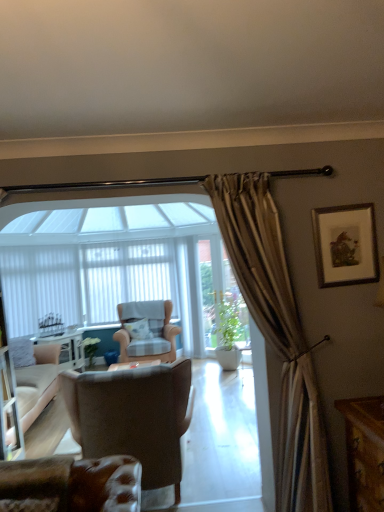
Question: Does point (137, 326) appear closer or farther from the camera than point (127, 324)?

Choices:
 (A) farther
 (B) closer

Answer: (A)

Question: Considering the relative positions of white textured pillow at center and checkered fabric armchair at center, which is counted as the third chair, starting from the front, in the image provided, is white textured pillow at center to the left or to the right of checkered fabric armchair at center, which is counted as the third chair, starting from the front,?

Choices:
 (A) right
 (B) left

Answer: (B)

Question: Estimate the real-world distances between objects in this image. Which object is closer to the brown leather chair at center, placed as the second chair when sorted from front to back?

Choices:
 (A) white textured pillow at center
 (B) white vertical blinds at center
 (C) leather at lower left, placed as the third chair when sorted from back to front
 (D) white glossy vase at center, the 2th plant from the right
 (E) white fabric curtain at left

Answer: (C)

Question: Which object is positioned closest to the brown leather chair at center, which ranks as the second chair in back-to-front order?

Choices:
 (A) green glossy plant at center, which ranks as the 2th plant in back-to-front order
 (B) white glossy vase at center, the 2th plant from the right
 (C) checkered fabric armchair at center, the first chair from the back
 (D) white vertical blinds at center
 (E) white textured pillow at center

Answer: (C)